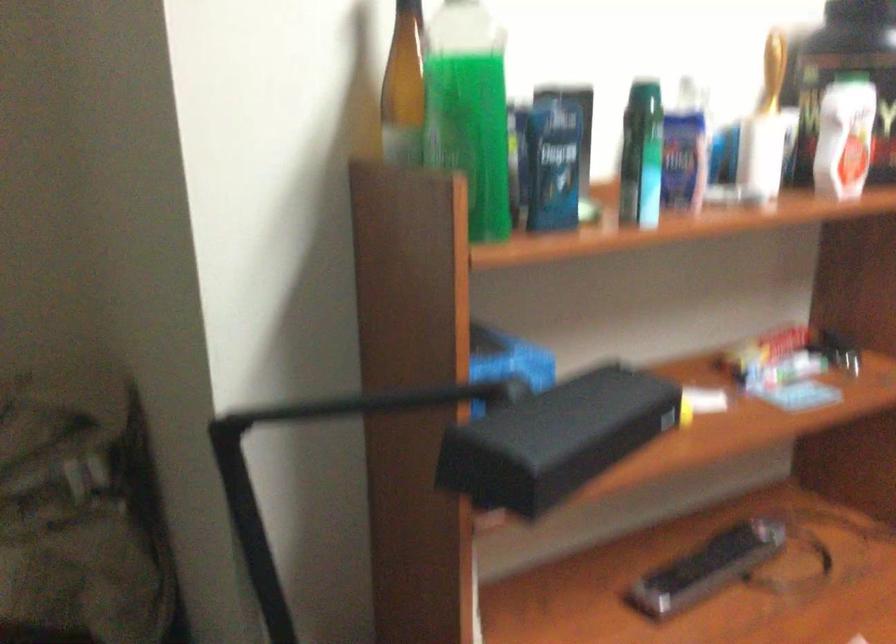
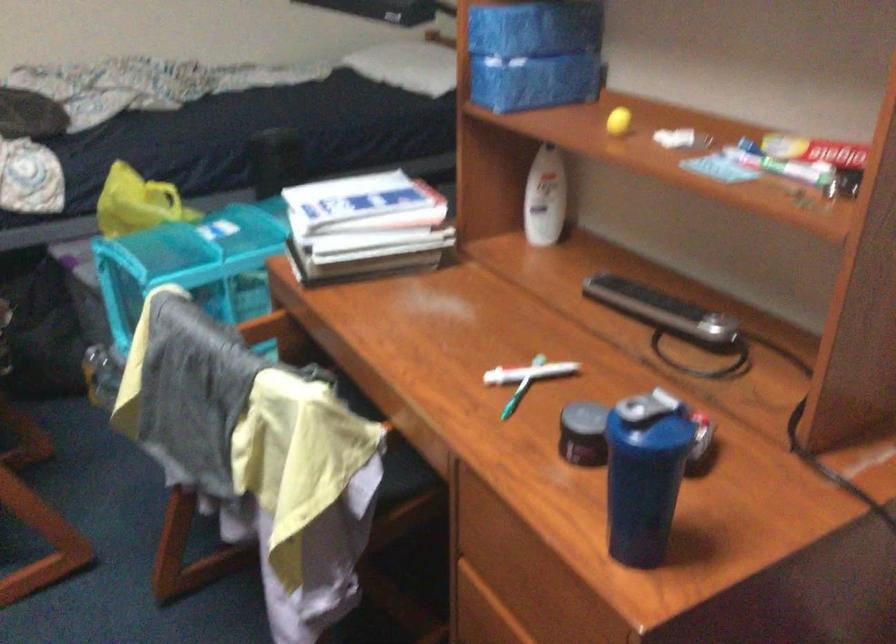
In the second image, find the point that corresponds to (x=675, y=406) in the first image.

(617, 120)